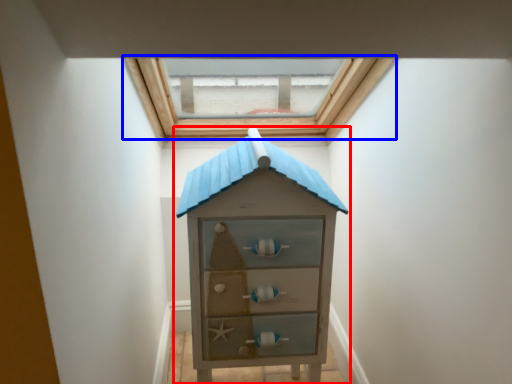
Question: Among these objects, which one is nearest to the camera, chest of drawers (highlighted by a red box) or window (highlighted by a blue box)?

Choices:
 (A) chest of drawers
 (B) window

Answer: (A)